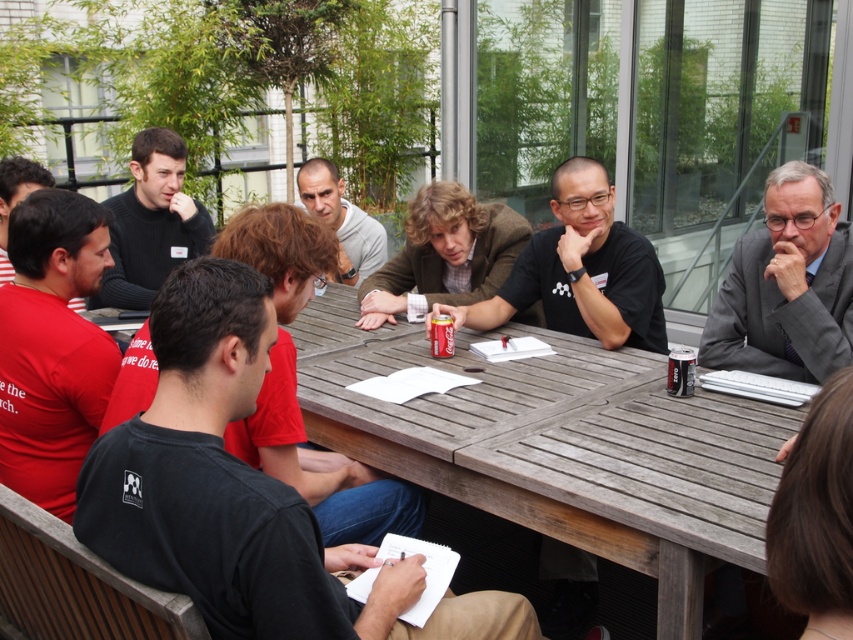
Question: Is gray suit at upper right to the left of red striped shirt at left from the viewer's perspective?

Choices:
 (A) no
 (B) yes

Answer: (A)

Question: Which point appears farthest from the camera in this image?

Choices:
 (A) (511, 275)
 (B) (393, 515)

Answer: (A)

Question: Which of the following is the closest to the observer?

Choices:
 (A) gray suit at upper right
 (B) red striped shirt at left
 (C) matte black shirt at center
 (D) black matte shirt at center

Answer: (A)

Question: Based on their relative distances, which object is nearer to the matte black shirt at center?

Choices:
 (A) black t-shirt at center
 (B) black cotton shirt at center
 (C) smooth gray shirt at center

Answer: (B)

Question: Does black matte shirt at center come in front of matte black shirt at center?

Choices:
 (A) yes
 (B) no

Answer: (B)

Question: Is gray suit at upper right positioned at the back of smooth gray shirt at center?

Choices:
 (A) yes
 (B) no

Answer: (B)